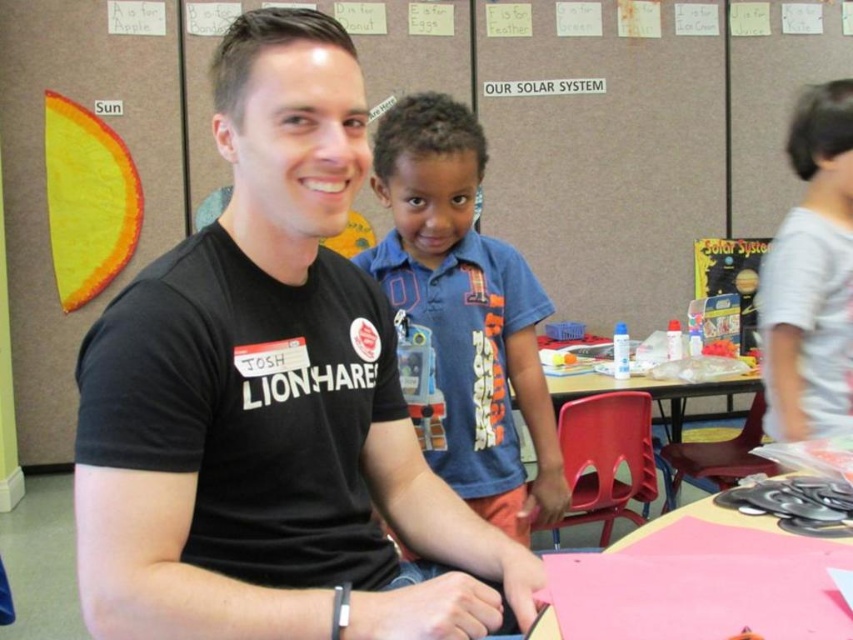
Which is more to the left, black matte t-shirt at center or blue cotton shirt at center?

black matte t-shirt at center

Is point (219, 138) positioned after point (457, 464)?

No, it is not.

Between point (82, 410) and point (392, 237), which one is positioned in front?

Point (82, 410) is in front.

At what (x,y) coordinates should I click in order to perform the action: click on black matte t-shirt at center. Please return your answer as a coordinate pair (x, y). Looking at the image, I should click on (271, 401).

Looking at this image, does plastic table at center have a larger size compared to pink paper at lower right?

Correct, plastic table at center is larger in size than pink paper at lower right.

Is plastic table at center to the right of pink paper at lower right from the viewer's perspective?

Correct, you'll find plastic table at center to the right of pink paper at lower right.

Is point (744, 380) closer to camera compared to point (686, 497)?

Yes.

At what (x,y) coordinates should I click in order to perform the action: click on plastic table at center. Please return your answer as a coordinate pair (x, y). Image resolution: width=853 pixels, height=640 pixels. Looking at the image, I should click on (666, 401).

Does black matte t-shirt at center appear on the left side of matte paper solar system chart at upper center?

Yes, black matte t-shirt at center is to the left of matte paper solar system chart at upper center.

What are the coordinates of `black matte t-shirt at center` in the screenshot? It's located at (271, 401).

This screenshot has width=853, height=640. I want to click on black matte t-shirt at center, so coord(271,401).